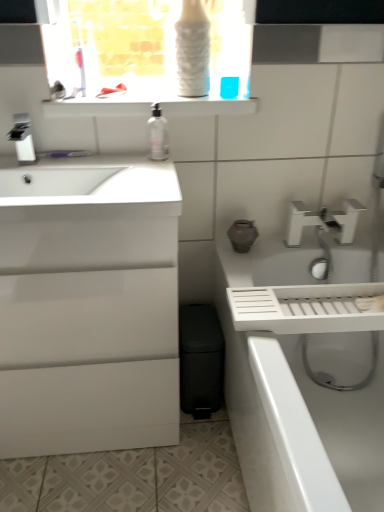
Question: Should I look upward or downward to see white glossy faucet at upper right, which is counted as the 2th tap, starting from the front?

Choices:
 (A) up
 (B) down

Answer: (A)

Question: Can you confirm if white glossy bath at right is taller than white glossy shelf at upper center?

Choices:
 (A) yes
 (B) no

Answer: (A)

Question: Is white glossy bath at right directly adjacent to white glossy shelf at upper center?

Choices:
 (A) yes
 (B) no

Answer: (B)

Question: From the image's perspective, is white glossy bath at right above white glossy shelf at upper center?

Choices:
 (A) no
 (B) yes

Answer: (A)

Question: Is white glossy bath at right at the left side of white glossy shelf at upper center?

Choices:
 (A) no
 (B) yes

Answer: (A)

Question: From a real-world perspective, is white glossy bath at right located higher than white glossy shelf at upper center?

Choices:
 (A) yes
 (B) no

Answer: (B)

Question: Does white glossy bath at right appear on the right side of white glossy shelf at upper center?

Choices:
 (A) yes
 (B) no

Answer: (A)

Question: Is white glossy faucet at upper right, which is counted as the 2th tap, starting from the front, outside of clear plastic bottle at center?

Choices:
 (A) no
 (B) yes

Answer: (B)

Question: Does white glossy faucet at upper right, arranged as the 1th tap when viewed from the right, contain clear plastic bottle at center?

Choices:
 (A) no
 (B) yes

Answer: (A)

Question: Can you confirm if white glossy faucet at upper right, arranged as the 1th tap when viewed from the right, is shorter than clear plastic bottle at center?

Choices:
 (A) no
 (B) yes

Answer: (B)

Question: Is white glossy faucet at upper right, the first tap when ordered from back to front, far away from clear plastic bottle at center?

Choices:
 (A) yes
 (B) no

Answer: (B)

Question: From a real-world perspective, is white glossy faucet at upper right, the first tap when ordered from back to front, physically below clear plastic bottle at center?

Choices:
 (A) yes
 (B) no

Answer: (A)

Question: Is white glossy faucet at upper right, the 2th tap positioned from the top, further to camera compared to clear plastic bottle at center?

Choices:
 (A) yes
 (B) no

Answer: (A)

Question: Is white glossy cabinet at left wider than clear plastic bottle at center?

Choices:
 (A) no
 (B) yes

Answer: (B)